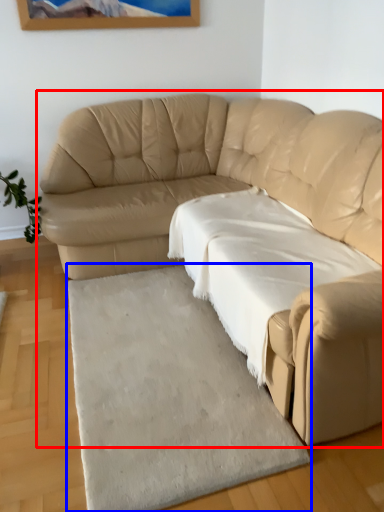
Question: Among these objects, which one is farthest to the camera, studio couch (highlighted by a red box) or mat (highlighted by a blue box)?

Choices:
 (A) studio couch
 (B) mat

Answer: (B)